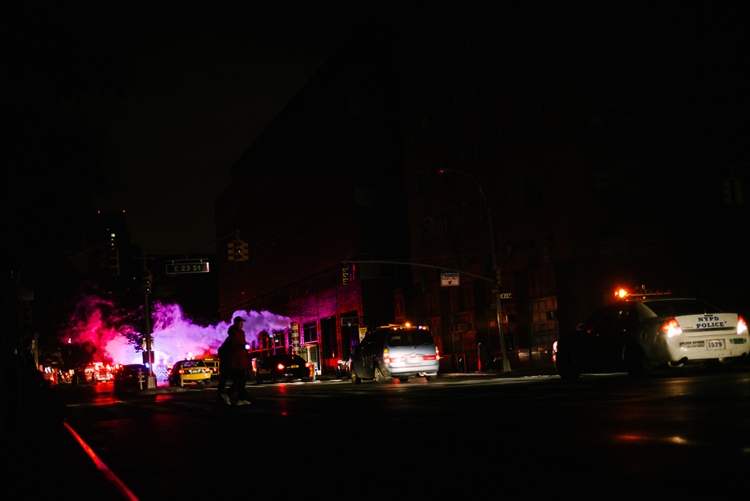
Find the location of a particular element. Image resolution: width=750 pixels, height=501 pixels. window is located at coordinates (321, 331).